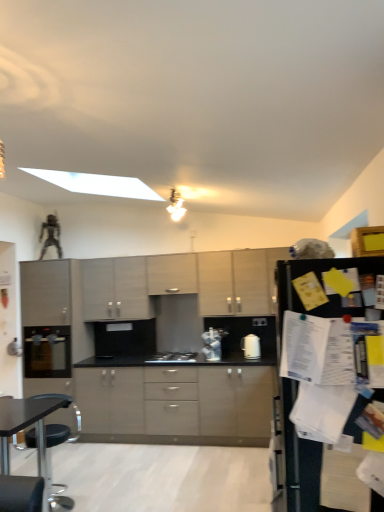
Question: In the image, is matte black oven at left, which appears as the second appliance when viewed from the right, on the left side or the right side of matte gray cabinets at center, the first cabinetry ordered from the bottom?

Choices:
 (A) right
 (B) left

Answer: (B)

Question: From the image's perspective, relative to matte gray cabinets at center, the first cabinetry ordered from the bottom, is matte black oven at left, arranged as the 1th appliance when viewed from the left, above or below?

Choices:
 (A) above
 (B) below

Answer: (A)

Question: Which object is the closest to the matte gray cabinet at center, the fourth cabinetry positioned from the bottom?

Choices:
 (A) matte black oven at left, arranged as the 1th appliance when viewed from the left
 (B) black plastic chair at lower left
 (C) matte gray cabinet at center, acting as the third cabinetry starting from the top
 (D) white glossy paper towel dispenser at center
 (E) satin silver toaster at center, positioned as the second appliance in left-to-right order

Answer: (C)

Question: Estimate the real-world distances between objects in this image. Which object is farther from the black matte gas stove at center?

Choices:
 (A) black plastic table at lower left
 (B) black plastic chair at lower left
 (C) matte gray cabinet at center, positioned as the second cabinetry in bottom-to-top order
 (D) matte gray cabinet at center, the fourth cabinetry positioned from the bottom
 (E) matte gray cabinets at center, marked as the 4th cabinetry in a top-to-bottom arrangement

Answer: (A)